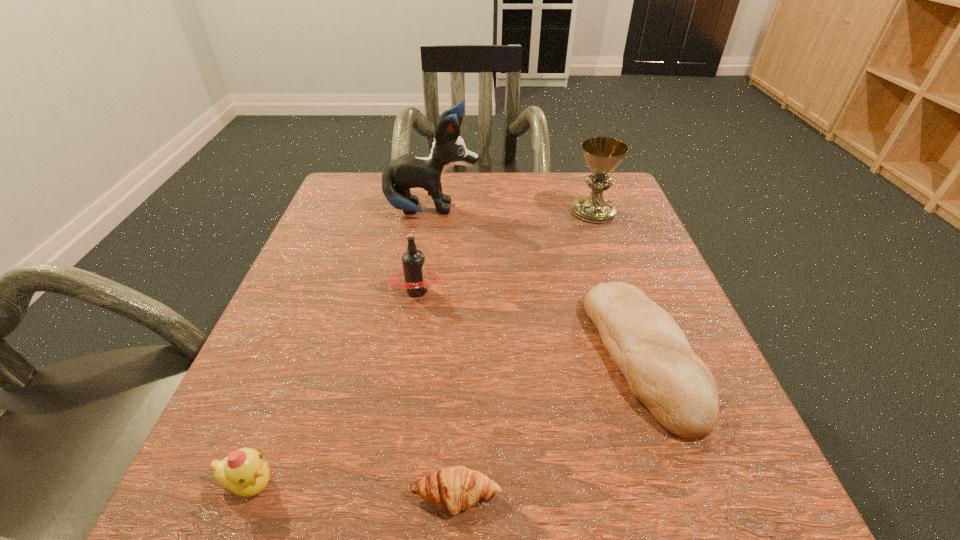
The height and width of the screenshot is (540, 960). Identify the location of object at the far left corner. (408, 171).

Find the location of a particular element. Image resolution: width=960 pixels, height=540 pixels. object present at the near left corner is located at coordinates (244, 472).

I want to click on object at the far right corner, so click(x=602, y=154).

At what (x,y) coordinates should I click in order to perform the action: click on blank space at the far edge of the desktop. Please return your answer as a coordinate pair (x, y). The image size is (960, 540). Looking at the image, I should click on (554, 208).

Locate an element on the screen. The width and height of the screenshot is (960, 540). vacant space at the left edge of the desktop is located at coordinates (288, 294).

In the image, there is a desktop. Identify the location of vacant space at the right edge. (641, 265).

At what (x,y) coordinates should I click in order to perform the action: click on free spot at the far right corner of the desktop. Please return your answer as a coordinate pair (x, y). Looking at the image, I should click on (620, 219).

In the image, there is a desktop. Where is `vacant space at the near right corner`? vacant space at the near right corner is located at coordinates (760, 526).

Identify the location of unoccupied position between the second tallest object and the leftmost object. The height and width of the screenshot is (540, 960). (421, 348).

Locate an element on the screen. This screenshot has height=540, width=960. free point between the chalice and the duckling is located at coordinates (421, 348).